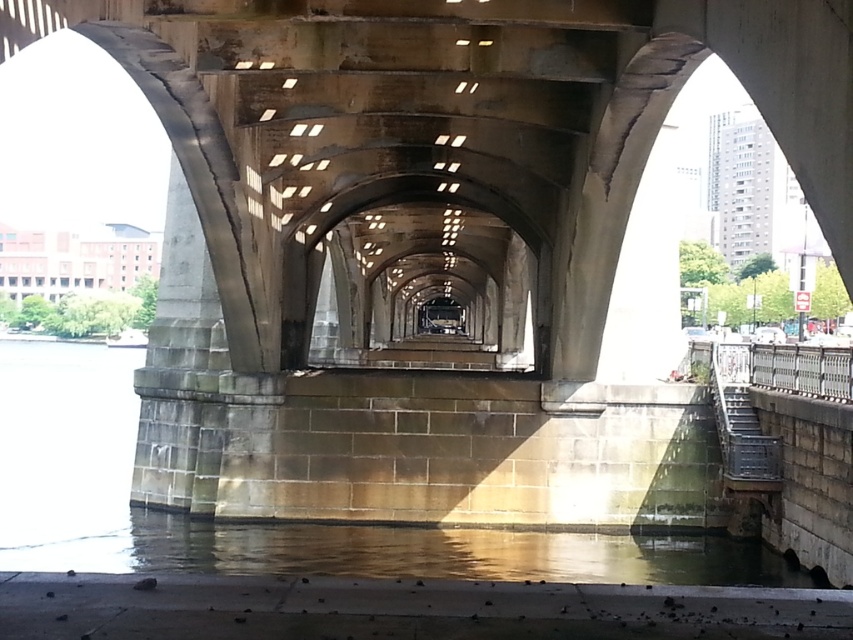
Which is in front, point (125, 556) or point (195, 321)?

Point (125, 556) is in front.

Is clear water at lower center to the left of gray stone pillar at center from the viewer's perspective?

In fact, clear water at lower center is to the right of gray stone pillar at center.

Image resolution: width=853 pixels, height=640 pixels. What are the coordinates of `clear water at lower center` in the screenshot? It's located at (390, 552).